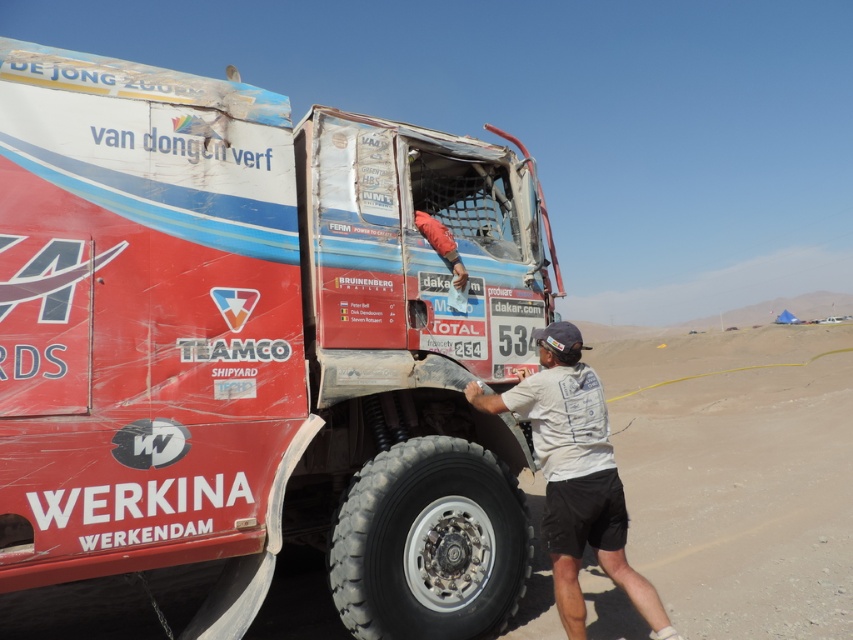
Question: Is black rubber tire at lower center wider than red fabric sleeve at upper center?

Choices:
 (A) no
 (B) yes

Answer: (B)

Question: Which object is closer to the camera taking this photo?

Choices:
 (A) white cotton shirt at center
 (B) black rubber tire at lower center
 (C) red fabric sleeve at upper center
 (D) scratched red truck at center

Answer: (D)

Question: Is scratched red truck at center bigger than black rubber tire at lower center?

Choices:
 (A) yes
 (B) no

Answer: (A)

Question: Is white cotton shirt at center above red fabric sleeve at upper center?

Choices:
 (A) yes
 (B) no

Answer: (B)

Question: Based on their relative distances, which object is farther from the white cotton shirt at center?

Choices:
 (A) red fabric sleeve at upper center
 (B) scratched red truck at center
 (C) black rubber tire at lower center

Answer: (A)

Question: Which object is positioned closest to the red fabric sleeve at upper center?

Choices:
 (A) scratched red truck at center
 (B) black rubber tire at lower center

Answer: (A)